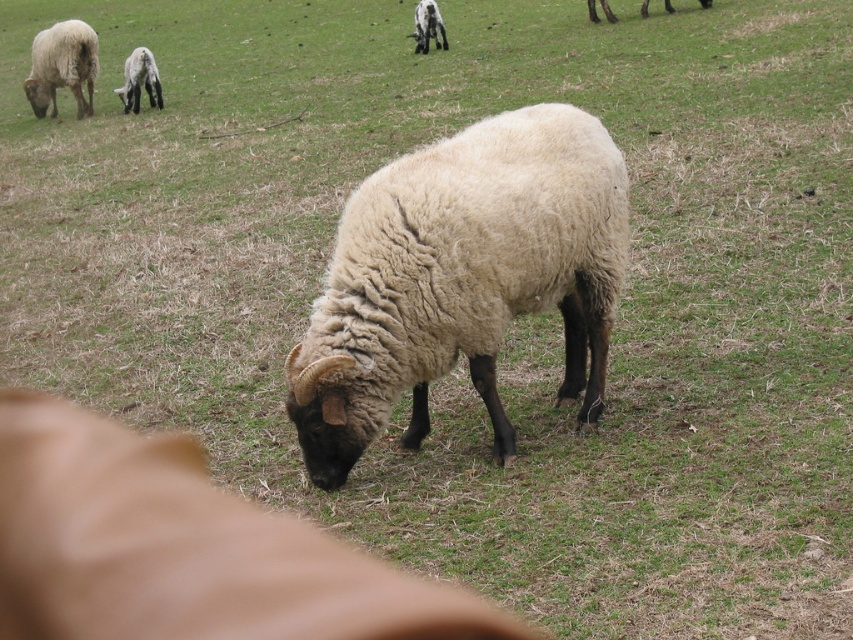
You are a farmer checking the field. You see the fluffy woolen sheep at center and the smooth leather dog at center. How far apart are these two animals from each other?

The fluffy woolen sheep at center and the smooth leather dog at center are 1.00 meters apart.

You are a photographer standing in the field and want to take a photo of the smooth leather dog at center and the white woolen sheep at center. Which one will appear larger in the photo?

The smooth leather dog at center will appear larger in the photo because it is closer to the viewer than the white woolen sheep at center.

You are a photographer trying to capture a picture of the fluffy woolen sheep at center and the smooth leather dog at center. From the photographer perspective, which animal is positioned to the right of the other?

The fluffy woolen sheep at center is positioned on the right side of smooth leather dog at center, so the fluffy woolen sheep at center is to the right of the smooth leather dog at center.